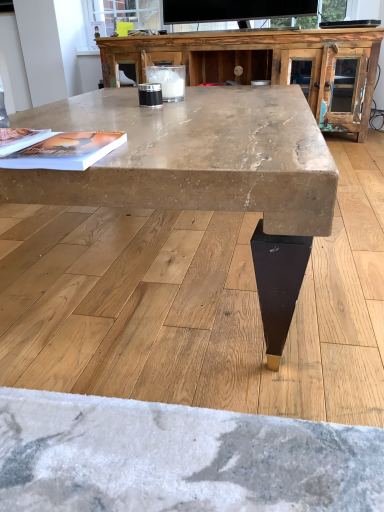
Find the location of a particular element. vacant space to the right of matte paper magazine at upper left, which is the second magazine from right to left is located at coordinates click(126, 135).